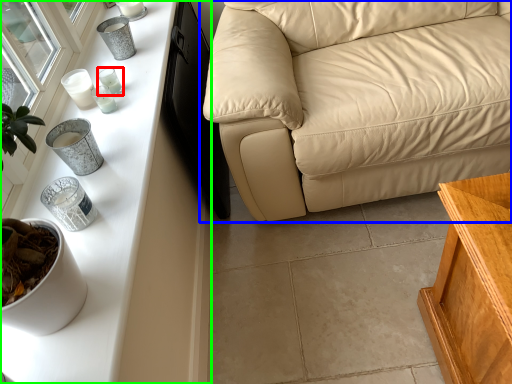
Question: Based on their relative distances, which object is farther from candle holder (highlighted by a red box)? Choose from studio couch (highlighted by a blue box) and table (highlighted by a green box).

Choices:
 (A) studio couch
 (B) table

Answer: (A)